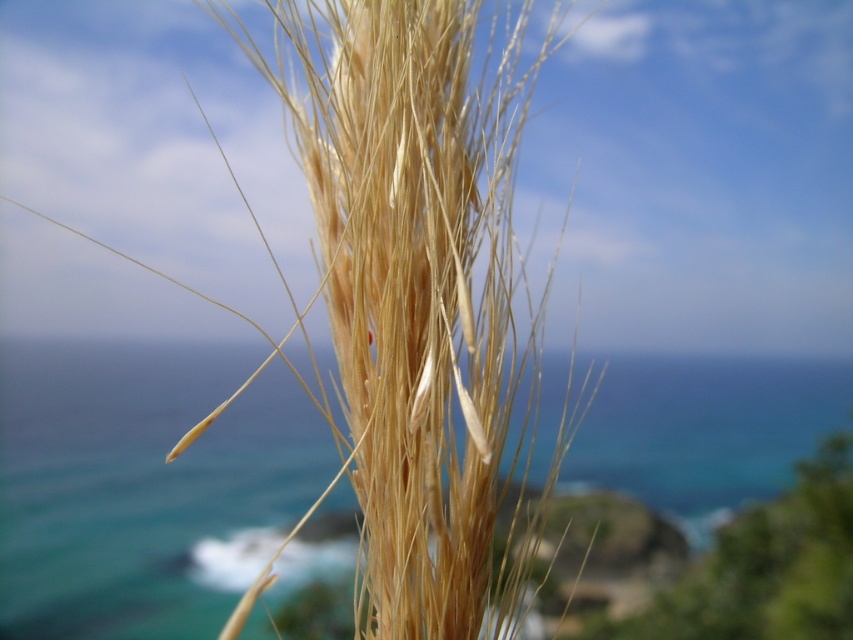
Who is lower down, golden straw reed at center or blue water at center?

blue water at center

Is golden straw reed at center wider than blue water at center?

No, golden straw reed at center is not wider than blue water at center.

Between point (396, 35) and point (635, 401), which one is positioned behind?

The point (635, 401) is behind.

Where is `golden straw reed at center`? The width and height of the screenshot is (853, 640). golden straw reed at center is located at coordinates (415, 304).